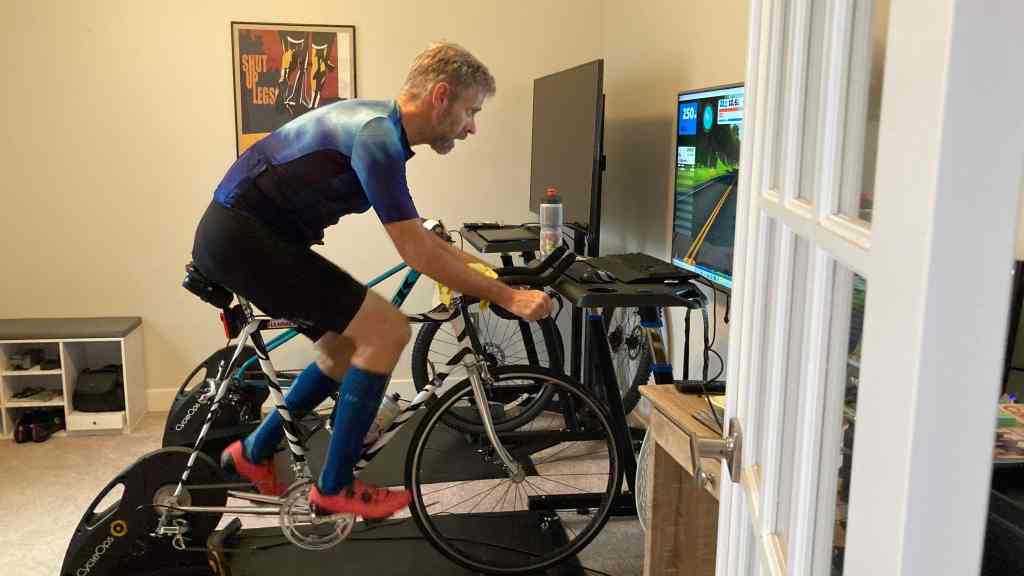
You are a GUI agent. You are given a task and a screenshot of the screen. Output one action in this format:
    pyautogui.click(x=<x>, y=<y>)
    Task: Click on the framed poster
    
    Given the screenshot: What is the action you would take?
    pyautogui.click(x=304, y=70)